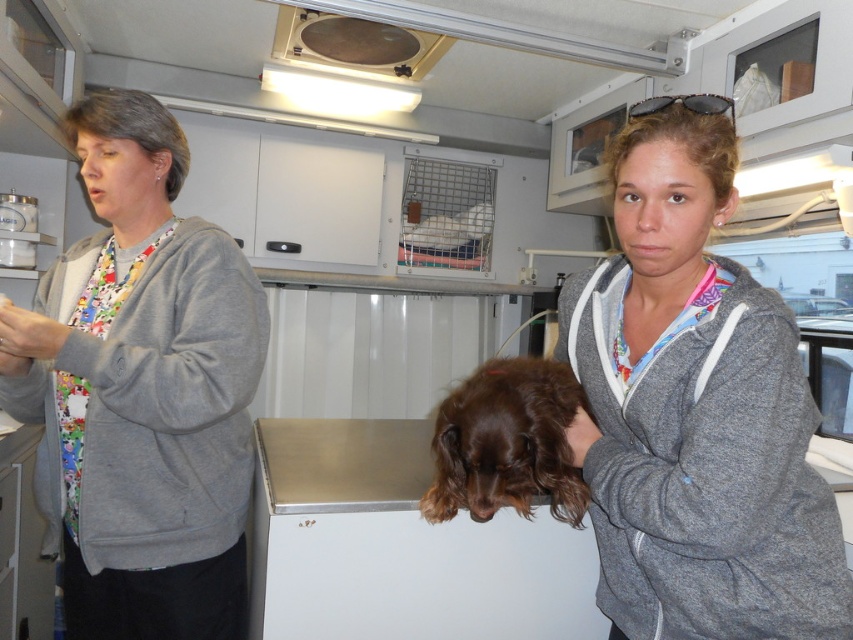
Question: Does gray fleece jacket at left come in front of matte black goggles at upper center?

Choices:
 (A) no
 (B) yes

Answer: (A)

Question: Does gray fleece jacket at left have a smaller size compared to brown furry dog at center?

Choices:
 (A) yes
 (B) no

Answer: (B)

Question: Is gray fleece jacket at center wider than brown furry dog at center?

Choices:
 (A) yes
 (B) no

Answer: (A)

Question: Which point appears farthest from the camera in this image?

Choices:
 (A) click(647, 356)
 (B) click(529, 470)

Answer: (B)

Question: Which is nearer to the matte black goggles at upper center?

Choices:
 (A) gray fleece jacket at center
 (B) brown furry dog at center
 (C) gray fleece jacket at left

Answer: (A)

Question: Considering the real-world distances, which object is closest to the gray fleece jacket at center?

Choices:
 (A) gray fleece jacket at left
 (B) matte black goggles at upper center

Answer: (B)